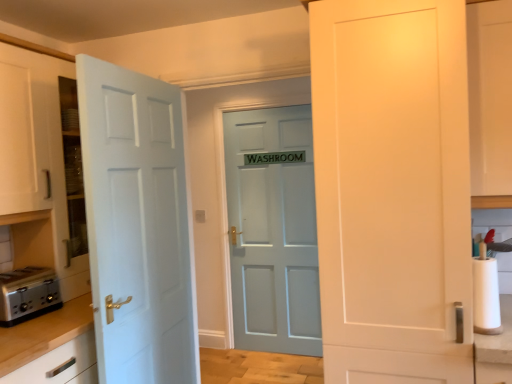
Question: Can you confirm if matte blue door at center, marked as the first door in a back-to-front arrangement, is smaller than white matte door at right, acting as the 3th door starting from the back?

Choices:
 (A) yes
 (B) no

Answer: (A)

Question: Can you confirm if matte blue door at center, marked as the third door in a front-to-back arrangement, is wider than white matte door at right, the 1th door when ordered from front to back?

Choices:
 (A) no
 (B) yes

Answer: (A)

Question: Does matte blue door at center, marked as the first door in a back-to-front arrangement, have a lesser width compared to white matte door at right, the 1th door when ordered from front to back?

Choices:
 (A) yes
 (B) no

Answer: (A)

Question: Considering the relative sizes of matte blue door at center, marked as the first door in a back-to-front arrangement, and white matte door at right, the 1th door when ordered from front to back, in the image provided, is matte blue door at center, marked as the first door in a back-to-front arrangement, shorter than white matte door at right, the 1th door when ordered from front to back,?

Choices:
 (A) no
 (B) yes

Answer: (A)

Question: Is matte blue door at center, marked as the first door in a back-to-front arrangement, oriented away from white matte door at right, the 1th door when ordered from front to back?

Choices:
 (A) no
 (B) yes

Answer: (A)

Question: Can you confirm if matte blue door at center, marked as the first door in a back-to-front arrangement, is taller than white matte door at right, the 1th door when ordered from front to back?

Choices:
 (A) no
 (B) yes

Answer: (B)

Question: Is white glossy cabinet at upper right smaller than white paper at right?

Choices:
 (A) yes
 (B) no

Answer: (B)

Question: Is the depth of white glossy cabinet at upper right greater than that of white paper at right?

Choices:
 (A) no
 (B) yes

Answer: (B)

Question: Is white glossy cabinet at upper right not inside white paper at right?

Choices:
 (A) yes
 (B) no

Answer: (A)

Question: Can you confirm if white glossy cabinet at upper right is wider than white paper at right?

Choices:
 (A) no
 (B) yes

Answer: (B)

Question: Is white paper at right inside white glossy cabinet at upper right?

Choices:
 (A) no
 (B) yes

Answer: (A)

Question: Are white glossy cabinet at upper right and white paper at right located far from each other?

Choices:
 (A) yes
 (B) no

Answer: (B)

Question: Is white matte door at right, acting as the 3th door starting from the back, thinner than white paper at right?

Choices:
 (A) no
 (B) yes

Answer: (A)